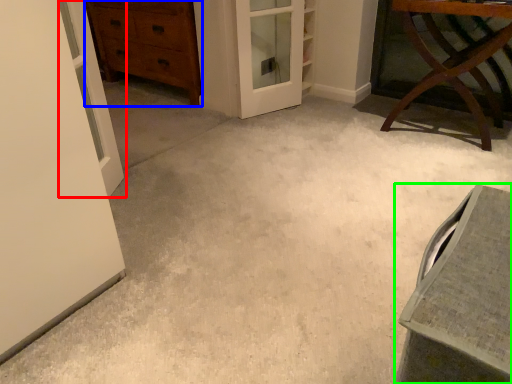
Question: Which object is positioned closest to door (highlighted by a red box)? Select from chest of drawers (highlighted by a blue box) and vanity (highlighted by a green box).

Choices:
 (A) chest of drawers
 (B) vanity

Answer: (B)